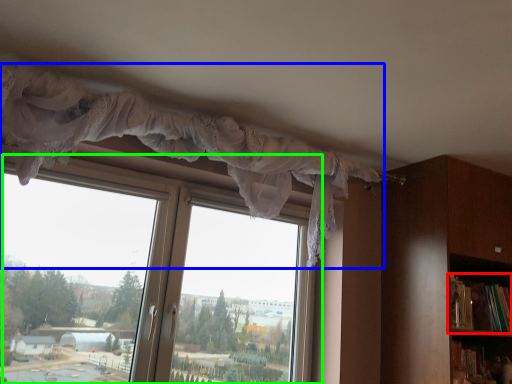
Question: Which object is positioned farthest from book (highlighted by a red box)? Select from curtain (highlighted by a blue box) and window (highlighted by a green box).

Choices:
 (A) curtain
 (B) window

Answer: (B)